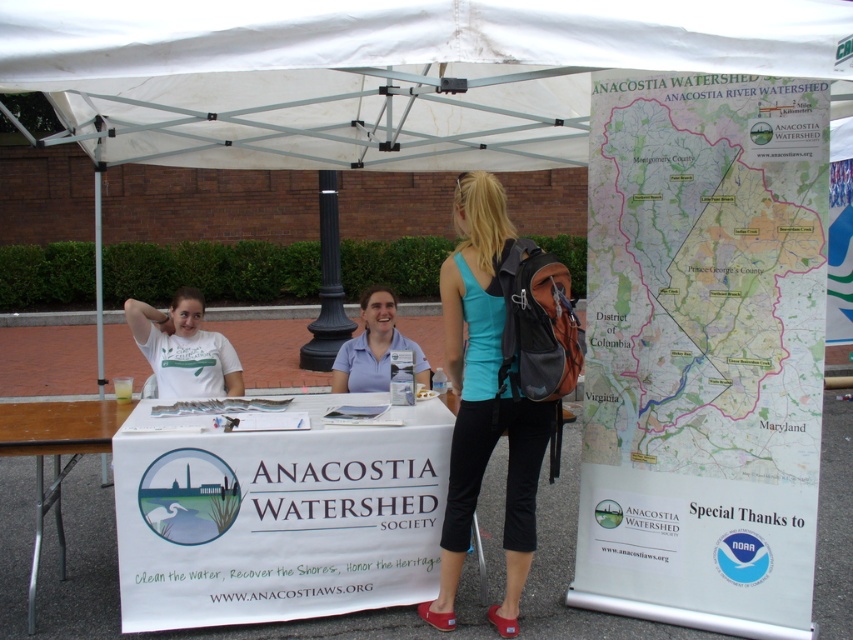
You are planning to set up a small booth under the white fabric canopy at upper center. The booth requires a minimum width of 2 meters. Can the booth fit under the canopy? Please consider the width of the black polished stone pole at center as a reference point.

The white fabric canopy at upper center is wider than the black polished stone pole at center. Since the pole is a reference point, but its exact width isn not provided, we cannot definitively determine if the canopy is at least 2 meters wide. More information is needed.